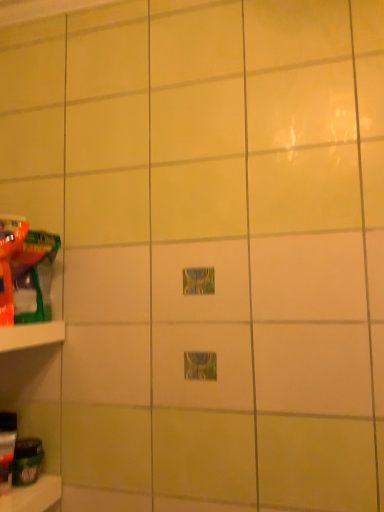
Question: From a real-world perspective, is white plastic shelf at left physically above translucent plastic toy at left, the first toy in the top-to-bottom sequence?

Choices:
 (A) yes
 (B) no

Answer: (B)

Question: Does white plastic shelf at left appear on the left side of translucent plastic toy at left, the first toy in the top-to-bottom sequence?

Choices:
 (A) no
 (B) yes

Answer: (B)

Question: Is translucent plastic toy at left, the fourth toy when ordered from bottom to top, surrounded by white plastic shelf at left?

Choices:
 (A) yes
 (B) no

Answer: (B)

Question: From a real-world perspective, is white plastic shelf at left under translucent plastic toy at left, the fourth toy when ordered from bottom to top?

Choices:
 (A) no
 (B) yes

Answer: (B)

Question: Considering the relative sizes of white plastic shelf at left and translucent plastic toy at left, the first toy in the top-to-bottom sequence, in the image provided, is white plastic shelf at left bigger than translucent plastic toy at left, the first toy in the top-to-bottom sequence,?

Choices:
 (A) no
 (B) yes

Answer: (A)

Question: Considering the positions of green matte jar at lower left, which appears as the 4th toy when viewed from the top, and white plastic shelf at left in the image, is green matte jar at lower left, which appears as the 4th toy when viewed from the top, taller or shorter than white plastic shelf at left?

Choices:
 (A) tall
 (B) short

Answer: (A)

Question: In terms of width, does green matte jar at lower left, which is counted as the first toy, starting from the bottom, look wider or thinner when compared to white plastic shelf at left?

Choices:
 (A) wide
 (B) thin

Answer: (B)

Question: Is green matte jar at lower left, which appears as the 4th toy when viewed from the top, in front of or behind white plastic shelf at left in the image?

Choices:
 (A) behind
 (B) front

Answer: (A)

Question: Considering the positions of point (34, 480) and point (13, 325), is point (34, 480) closer or farther from the camera than point (13, 325)?

Choices:
 (A) farther
 (B) closer

Answer: (A)

Question: From a real-world perspective, is translucent plastic bottle at lower left, arranged as the second toy when ordered from the bottom, physically located above or below white plastic shelf at left?

Choices:
 (A) below
 (B) above

Answer: (A)

Question: Which is correct: translucent plastic bottle at lower left, arranged as the second toy when ordered from the bottom, is inside white plastic shelf at left, or outside of it?

Choices:
 (A) inside
 (B) outside

Answer: (B)

Question: Is point 11,448 closer or farther from the camera than point 6,348?

Choices:
 (A) farther
 (B) closer

Answer: (A)

Question: Is translucent plastic bottle at lower left, positioned as the 3th toy in top-to-bottom order, taller or shorter than white plastic shelf at left?

Choices:
 (A) tall
 (B) short

Answer: (A)

Question: From a real-world perspective, is white plastic shelf at left physically located above or below translucent plastic toy at left, the first toy in the top-to-bottom sequence?

Choices:
 (A) below
 (B) above

Answer: (A)

Question: Is white plastic shelf at left spatially inside translucent plastic toy at left, the fourth toy when ordered from bottom to top, or outside of it?

Choices:
 (A) inside
 (B) outside

Answer: (B)